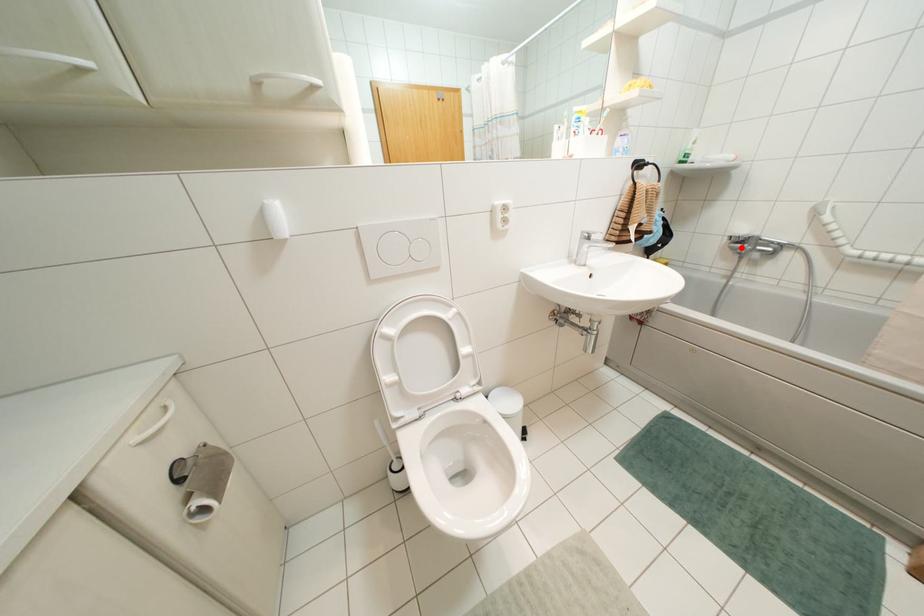
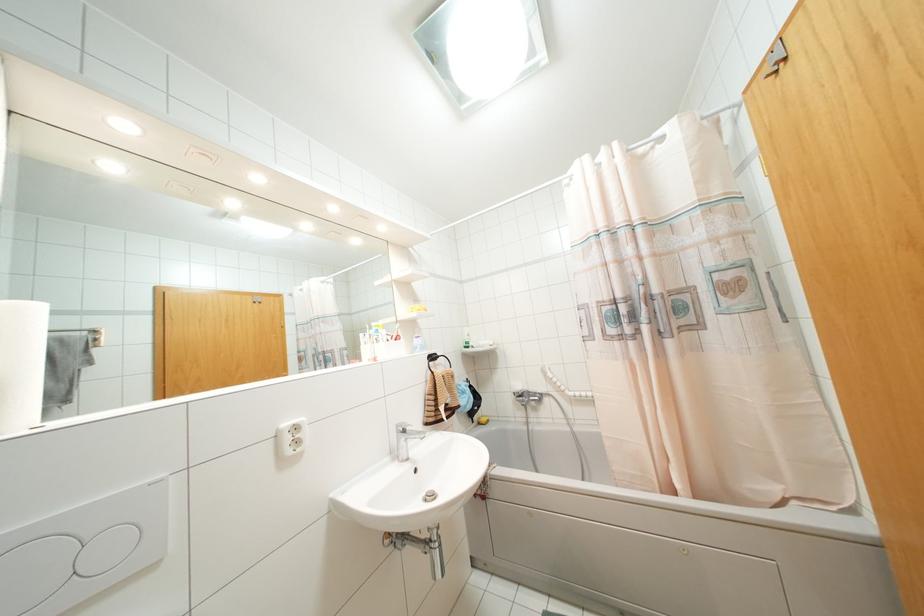
Question: A red point is marked in image1. In image2, is the corresponding 3D point closer to the camera or farther? Reply with the corresponding letter.

Choices:
 (A) The corresponding 3D point is closer.
 (B) The corresponding 3D point is farther.

Answer: (B)